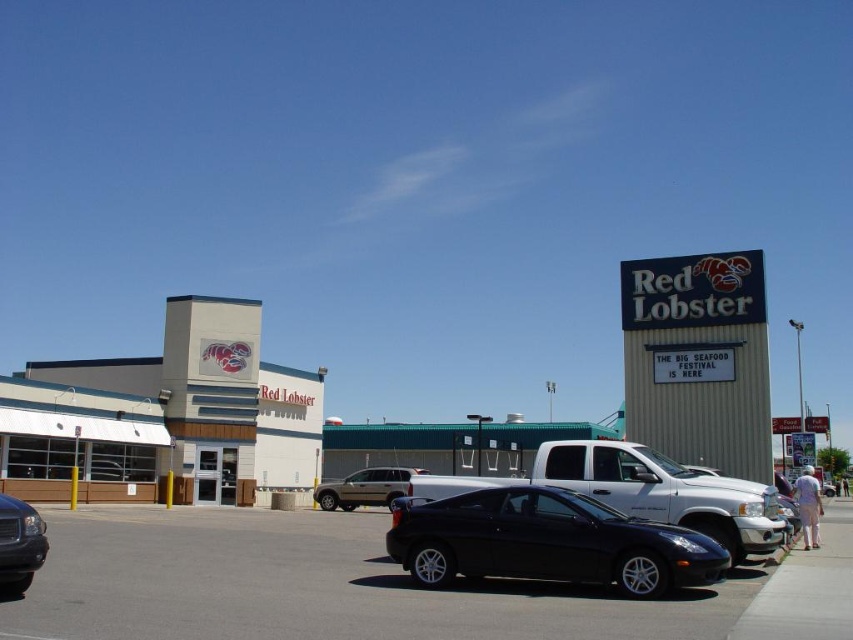
Between black car at center and matte white building at left, which one appears on the left side from the viewer's perspective?

matte white building at left

Who is taller, black car at center or matte white building at left?

matte white building at left is taller.

In order to click on black car at center in this screenshot , I will do `click(376, 586)`.

Find the location of a particular element. black car at center is located at coordinates (376, 586).

Between shiny black sedan at lower left and metallic silver suv at center, which one has less height?

shiny black sedan at lower left is shorter.

Is shiny black sedan at lower left below metallic silver suv at center?

No, shiny black sedan at lower left is not below metallic silver suv at center.

Between point (3, 552) and point (364, 500), which one is positioned in front?

Positioned in front is point (3, 552).

This screenshot has width=853, height=640. Identify the location of shiny black sedan at lower left. [19, 545].

Is point (218, 608) less distant than point (631, 541)?

Yes, point (218, 608) is in front of point (631, 541).

This screenshot has height=640, width=853. Find the location of `black car at center`. black car at center is located at coordinates (376, 586).